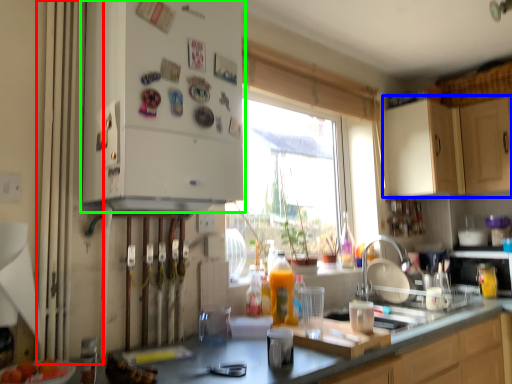
Question: Based on their relative distances, which object is farther from curtain (highlighted by a red box)? Choose from cabinetry (highlighted by a blue box) and cabinetry (highlighted by a green box).

Choices:
 (A) cabinetry
 (B) cabinetry

Answer: (A)